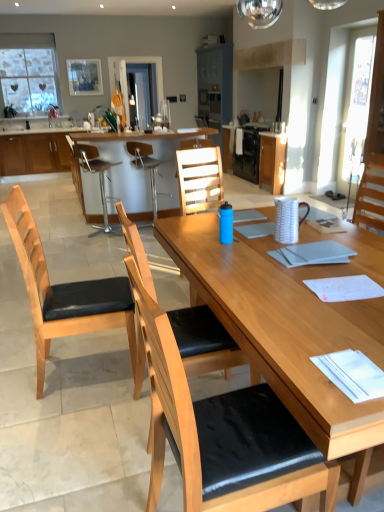
Question: Can you see light brown wood chair at center, placed as the 5th chair when sorted from front to back, touching glass heart-patterned window at upper left?

Choices:
 (A) no
 (B) yes

Answer: (A)

Question: Is light brown wood chair at center, placed as the 5th chair when sorted from front to back, oriented away from glass heart-patterned window at upper left?

Choices:
 (A) no
 (B) yes

Answer: (A)

Question: Is the position of light brown wood chair at center, the 1th chair when ordered from back to front, more distant than that of glass heart-patterned window at upper left?

Choices:
 (A) no
 (B) yes

Answer: (A)

Question: Is light brown wood chair at center, the 1th chair when ordered from back to front, thinner than glass heart-patterned window at upper left?

Choices:
 (A) no
 (B) yes

Answer: (A)

Question: Is glass heart-patterned window at upper left inside light brown wood chair at center, placed as the 5th chair when sorted from front to back?

Choices:
 (A) no
 (B) yes

Answer: (A)

Question: From a real-world perspective, is wooden chair with black cushion at center, which is counted as the 2th chair, starting from the front, above or below wooden chair with black cushion at center, which is the fifth chair in back-to-front order?

Choices:
 (A) above
 (B) below

Answer: (B)

Question: Considering the positions of wooden chair with black cushion at center, marked as the fourth chair in a back-to-front arrangement, and wooden chair with black cushion at center, the first chair in the front-to-back sequence, in the image, is wooden chair with black cushion at center, marked as the fourth chair in a back-to-front arrangement, taller or shorter than wooden chair with black cushion at center, the first chair in the front-to-back sequence,?

Choices:
 (A) short
 (B) tall

Answer: (A)

Question: Considering their positions, is wooden chair with black cushion at center, which is counted as the 2th chair, starting from the front, located in front of or behind wooden chair with black cushion at center, which is the fifth chair in back-to-front order?

Choices:
 (A) behind
 (B) front

Answer: (A)

Question: Based on their positions, is wooden chair with black cushion at center, which is counted as the 2th chair, starting from the front, located to the left or right of wooden chair with black cushion at center, the first chair in the front-to-back sequence?

Choices:
 (A) left
 (B) right

Answer: (A)

Question: Is white glossy sink at upper center bigger or smaller than glass heart-patterned window at upper left?

Choices:
 (A) big
 (B) small

Answer: (B)

Question: Looking at their shapes, would you say white glossy sink at upper center is wider or thinner than glass heart-patterned window at upper left?

Choices:
 (A) thin
 (B) wide

Answer: (B)

Question: Relative to glass heart-patterned window at upper left, is white glossy sink at upper center in front or behind?

Choices:
 (A) behind
 (B) front

Answer: (B)

Question: Would you say white glossy sink at upper center is to the left or to the right of glass heart-patterned window at upper left in the picture?

Choices:
 (A) left
 (B) right

Answer: (B)

Question: Is wooden cabinet at center, marked as the third cabinetry in a left-to-right arrangement, taller or shorter than wooden cabinet at left, which is the 3th cabinetry from right to left?

Choices:
 (A) tall
 (B) short

Answer: (A)

Question: Is wooden cabinet at center, marked as the third cabinetry in a left-to-right arrangement, wider or thinner than wooden cabinet at left, which is the 3th cabinetry from right to left?

Choices:
 (A) thin
 (B) wide

Answer: (A)